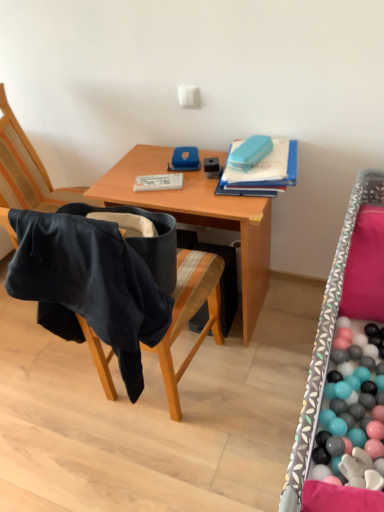
Where is `free location to the left of blue matte folder at upper right`? free location to the left of blue matte folder at upper right is located at coordinates (182, 182).